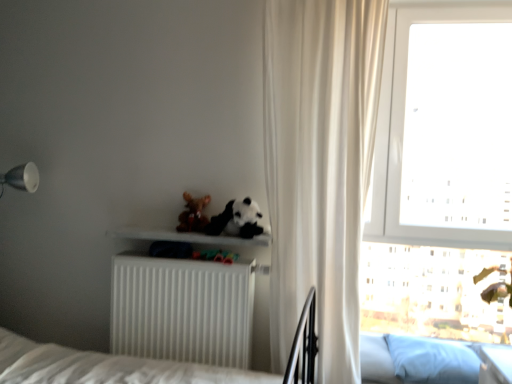
Question: From a real-world perspective, is transparent glass window at upper right physically located above or below white sheer curtain at right?

Choices:
 (A) above
 (B) below

Answer: (A)

Question: Is point (464, 332) positioned closer to the camera than point (330, 41)?

Choices:
 (A) farther
 (B) closer

Answer: (A)

Question: Which of these objects is positioned closest to the white sheer curtain at right?

Choices:
 (A) white matte shelf at center
 (B) white matte radiator at lower center
 (C) fuzzy brown teddy bear at center
 (D) blue fabric pillow at lower right
 (E) transparent glass window at upper right

Answer: (B)

Question: Which of these objects is positioned farthest from the white matte radiator at lower center?

Choices:
 (A) white matte shelf at center
 (B) fuzzy brown teddy bear at center
 (C) blue fabric pillow at lower right
 (D) white sheer curtain at right
 (E) transparent glass window at upper right

Answer: (E)